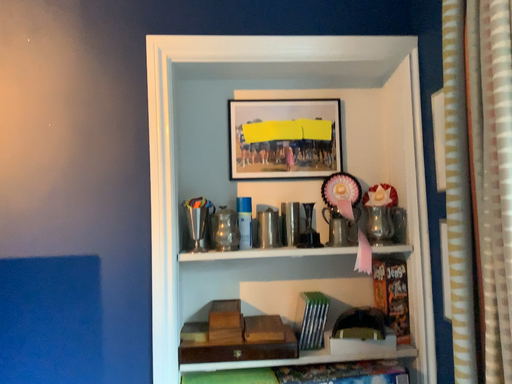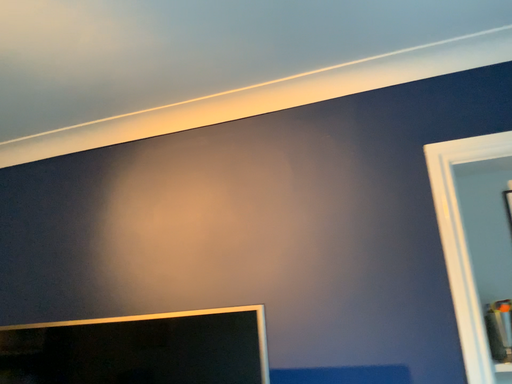
Question: How did the camera likely rotate when shooting the video?

Choices:
 (A) rotated left
 (B) rotated right

Answer: (A)